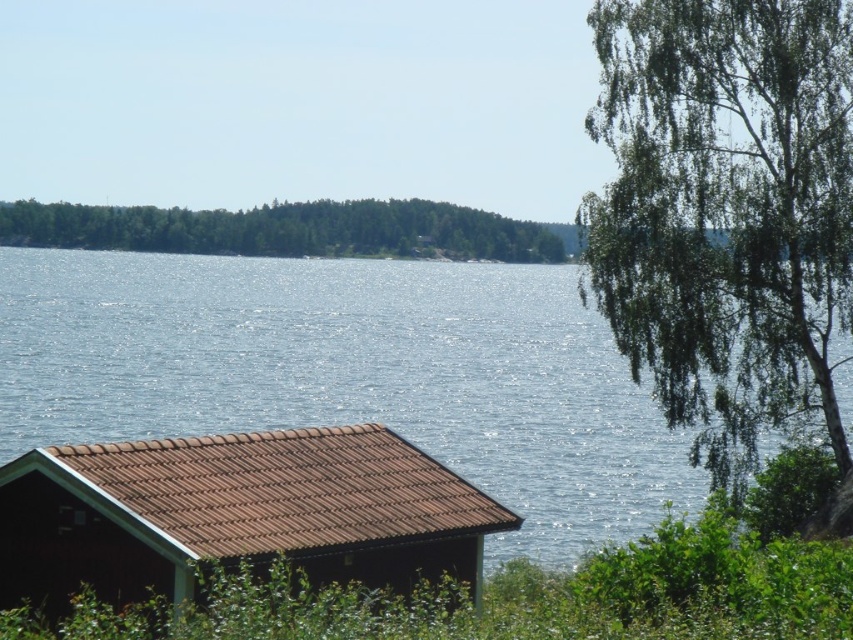
Question: Which point is farther to the camera?

Choices:
 (A) green leafy tree at upper right
 (B) green leafy forest at upper left
 (C) glistening blue water at center

Answer: (B)

Question: Is the position of glistening blue water at center more distant than that of green leafy forest at upper left?

Choices:
 (A) yes
 (B) no

Answer: (B)

Question: Does green leafy tree at upper right appear on the right side of brown tile cabin at lower left?

Choices:
 (A) yes
 (B) no

Answer: (A)

Question: Which object is the closest to the brown tile cabin at lower left?

Choices:
 (A) green leafy tree at upper right
 (B) green leafy forest at upper left

Answer: (A)

Question: Which point is closer to the camera?

Choices:
 (A) brown tile cabin at lower left
 (B) glistening blue water at center
 (C) green leafy tree at upper right
 (D) green leafy forest at upper left

Answer: (A)

Question: Is glistening blue water at center positioned at the back of brown tile cabin at lower left?

Choices:
 (A) yes
 (B) no

Answer: (A)